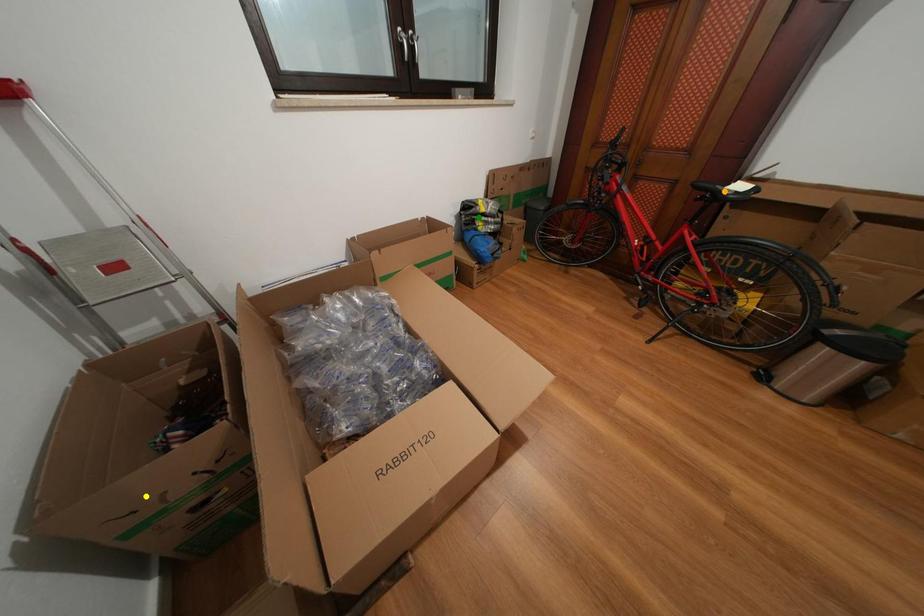
Order these from nearest to farthest:
green point | yellow point | orange point

green point
orange point
yellow point